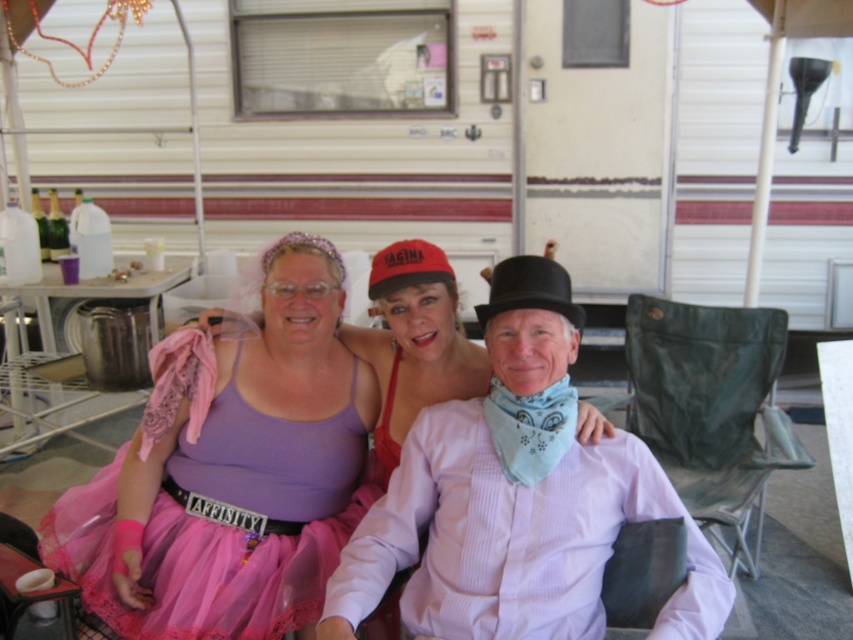
Is light pink cotton shirt at center positioned at the back of pink tulle dress at center?

No.

Can you confirm if light pink cotton shirt at center is taller than pink tulle dress at center?

Yes, light pink cotton shirt at center is taller than pink tulle dress at center.

Locate an element on the screen. The height and width of the screenshot is (640, 853). light pink cotton shirt at center is located at coordinates (515, 499).

I want to click on light pink cotton shirt at center, so click(515, 499).

Is point (671, 40) positioned before point (552, 451)?

No, it is behind (552, 451).

Which is more to the left, white plastic recreational vehicle at center or light pink cotton shirt at center?

white plastic recreational vehicle at center is more to the left.

Where is `white plastic recreational vehicle at center`? Image resolution: width=853 pixels, height=640 pixels. white plastic recreational vehicle at center is located at coordinates (440, 147).

At what (x,y) coordinates should I click in order to perform the action: click on white plastic recreational vehicle at center. Please return your answer as a coordinate pair (x, y). Looking at the image, I should click on (440, 147).

Does white plastic recreational vehicle at center come behind pink tulle dress at center?

That is True.

Which is above, white plastic recreational vehicle at center or pink tulle dress at center?

white plastic recreational vehicle at center

Does point (569, 74) come in front of point (316, 509)?

No.

This screenshot has width=853, height=640. I want to click on white plastic recreational vehicle at center, so click(440, 147).